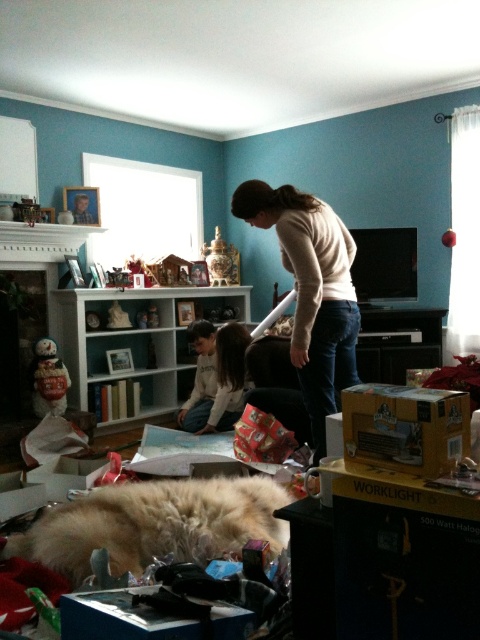
Is white soft sweater at center taller than white ceramic snowman at lower left?

Correct, white soft sweater at center is much taller as white ceramic snowman at lower left.

Which is in front, point (216, 387) or point (67, 387)?

Point (67, 387)

Describe the element at coordinates (216, 378) in the screenshot. I see `white soft sweater at center` at that location.

This screenshot has height=640, width=480. Find the location of `white soft sweater at center`. white soft sweater at center is located at coordinates (216, 378).

Is the position of light beige sweater at center less distant than that of white soft sweater at center?

That is True.

Does point (315, 304) come farther from viewer compared to point (239, 396)?

No, (315, 304) is closer to viewer.

What do you see at coordinates (312, 291) in the screenshot?
I see `light beige sweater at center` at bounding box center [312, 291].

At what (x,y) coordinates should I click in order to perform the action: click on light beige sweater at center. Please return your answer as a coordinate pair (x, y). The height and width of the screenshot is (640, 480). Looking at the image, I should click on (312, 291).

Is blue cardboard box at lower center bigger than porcelain vase at center?

Incorrect, blue cardboard box at lower center is not larger than porcelain vase at center.

Looking at this image, does blue cardboard box at lower center have a smaller size compared to porcelain vase at center?

Yes.

Image resolution: width=480 pixels, height=640 pixels. Describe the element at coordinates (120, 618) in the screenshot. I see `blue cardboard box at lower center` at that location.

Locate an element on the screen. blue cardboard box at lower center is located at coordinates (120, 618).